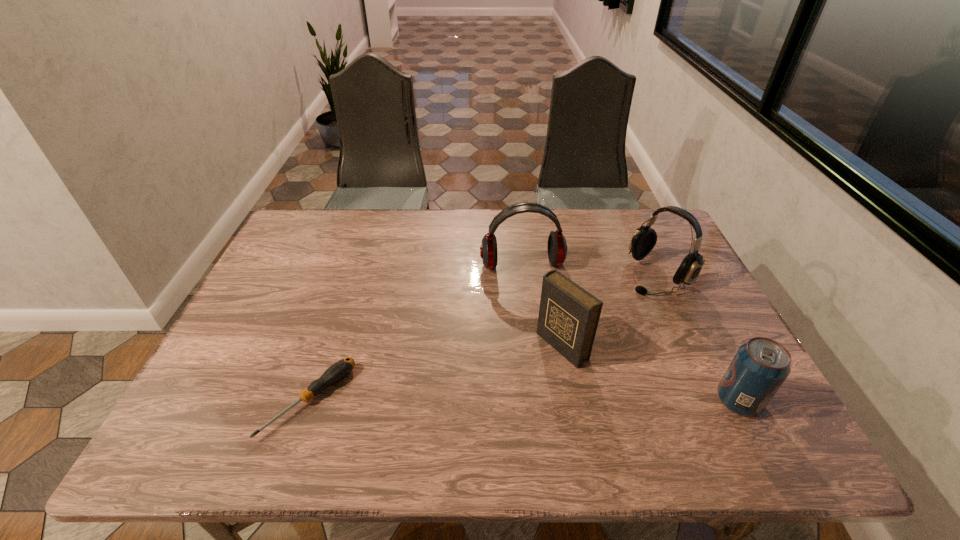
This screenshot has height=540, width=960. What are the coordinates of `screwdriver` in the screenshot? It's located at (339, 370).

Where is `the leftmost object`? This screenshot has width=960, height=540. the leftmost object is located at coordinates (339, 370).

Identify the location of the second shortest object. (759, 368).

The height and width of the screenshot is (540, 960). I want to click on earphone, so click(557, 248).

This screenshot has height=540, width=960. I want to click on headset, so click(x=644, y=239).

I want to click on diary, so click(568, 318).

At what (x,y) coordinates should I click in order to perform the action: click on free space located 0.150m on the left of the screwdriver. Please return your answer as a coordinate pair (x, y). Looking at the image, I should click on (201, 400).

Locate an element on the screen. vacant space positioned 0.250m on the back of the fourth tallest object is located at coordinates (689, 305).

Locate an element on the screen. free spot located 0.200m on the ear cups of the earphone is located at coordinates (539, 328).

At what (x,y) coordinates should I click in order to perform the action: click on free space located on the ear cups of the earphone. Please return your answer as a coordinate pair (x, y). This screenshot has width=960, height=540. Looking at the image, I should click on pyautogui.click(x=548, y=370).